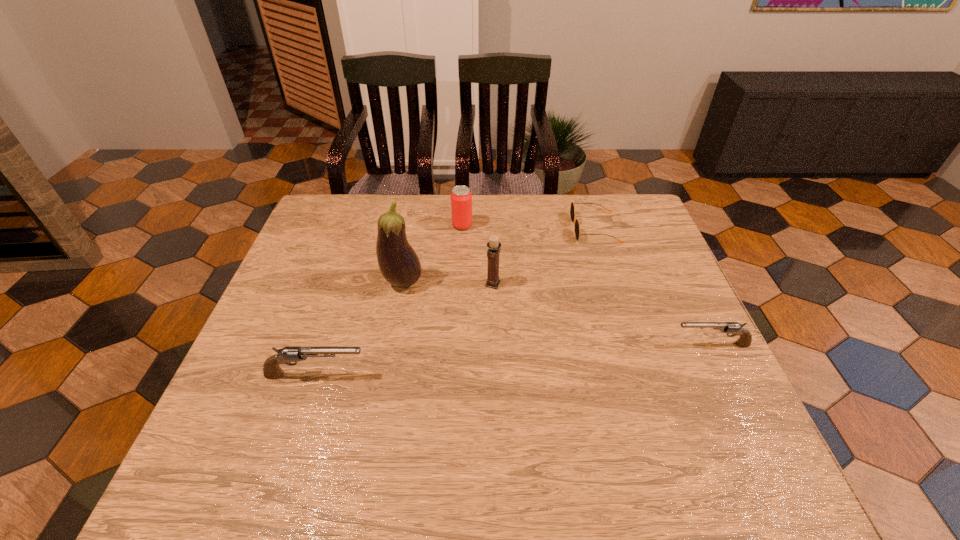
In order to click on free space between the beer can and the fifth farthest object in this screenshot , I will do `click(587, 285)`.

You are a GUI agent. You are given a task and a screenshot of the screen. Output one action in this format:
    pyautogui.click(x=<x>, y=<y>)
    Task: Click on the free point between the eggplant and the third object from right to left
    
    Given the screenshot: What is the action you would take?
    pyautogui.click(x=447, y=283)

Where is `object that is the fourth closest to the third tallest object`? object that is the fourth closest to the third tallest object is located at coordinates (271, 369).

Where is `object that can be found as the fifth closest to the rightmost object`? Image resolution: width=960 pixels, height=540 pixels. object that can be found as the fifth closest to the rightmost object is located at coordinates (271, 369).

Where is `vacant region that satisfies the following two spatial constraints: 1. on the front side of the beer can; 2. aiming along the barrel of the third shortest object`? vacant region that satisfies the following two spatial constraints: 1. on the front side of the beer can; 2. aiming along the barrel of the third shortest object is located at coordinates (455, 375).

Locate an element on the screen. This screenshot has height=540, width=960. free space that satisfies the following two spatial constraints: 1. on the front-facing side of the sunglasses; 2. on the front side of the eggplant is located at coordinates (612, 282).